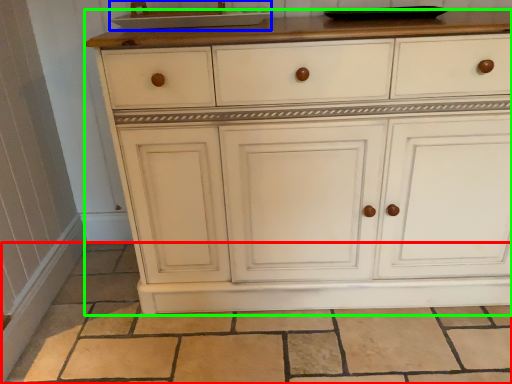
Question: Based on their relative distances, which object is farther from tile (highlighted by a red box)? Choose from sink (highlighted by a blue box) and chest of drawers (highlighted by a green box).

Choices:
 (A) sink
 (B) chest of drawers

Answer: (A)